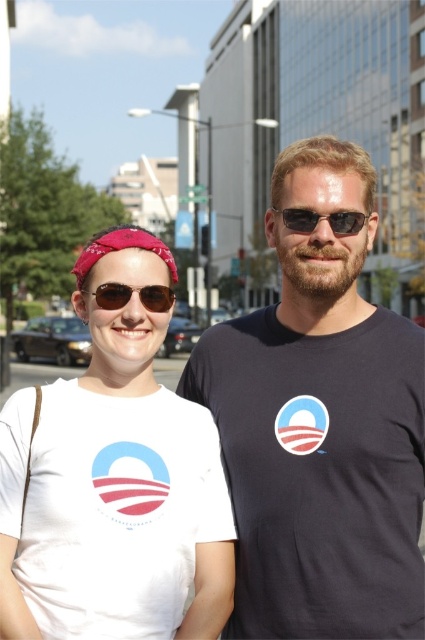
You are a photographer trying to capture a closeup of the red bandana at center and sunglasses at center. Which object should you focus on first if you want to capture both in one frame without moving the camera?

The red bandana at center is to the left of sunglasses at center, so you should focus on the red bandana at center first to ensure both are in frame.

You are trying to locate the red bandana at center in a photo. According to the coordinates provided, where exactly is it positioned?

The red bandana at center is located at coordinates point [121,248].